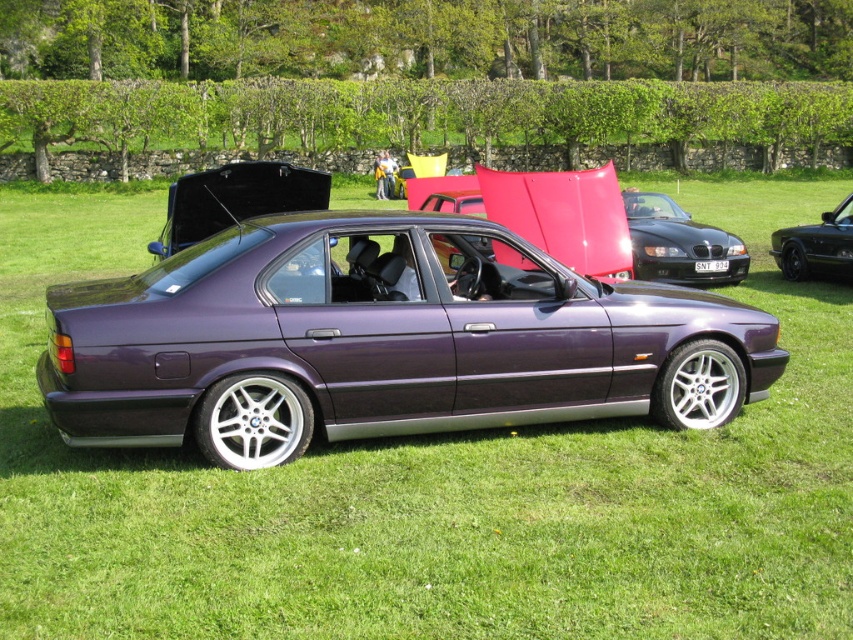
You are standing in the grassy field looking at the cars. There are two points marked in the image. The first point is at coordinate point (277, 392) and the second point is at coordinate point (380, 156). Which point is closer to you?

Point (277, 392) is closer to the viewer than point (380, 156).

You are a mechanic who needs to access the silver metallic rim at lower center to perform maintenance. There is a metallic purple car at center nearby. Can you reach the rim without moving the car?

The metallic purple car at center and silver metallic rim at lower center are 24.15 inches apart from each other. Since the distance between them is only 24.15 inches, you would need to move the metallic purple car at center to access the rim, as there isn not enough space to work comfortably without moving the car.